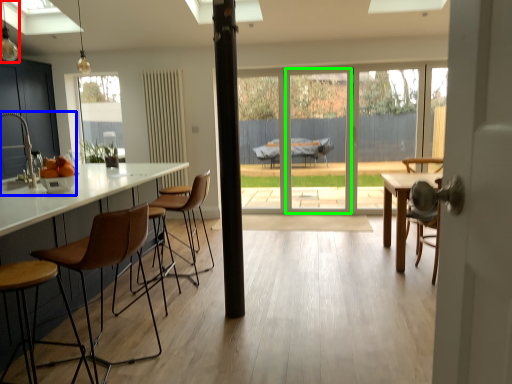
Question: Based on their relative distances, which object is farther from light fixture (highlighted by a red box)? Choose from sink (highlighted by a blue box) and screen door (highlighted by a green box).

Choices:
 (A) sink
 (B) screen door

Answer: (B)